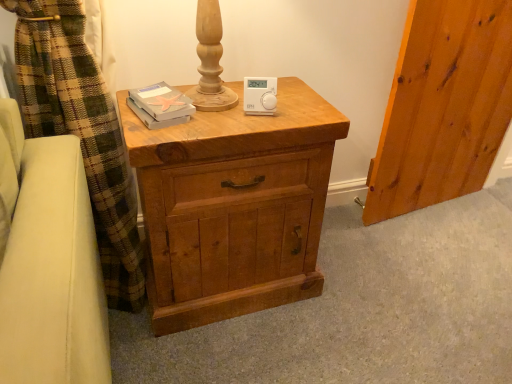
Where is `vacant space to the right of matte gray book at upper left`? The width and height of the screenshot is (512, 384). vacant space to the right of matte gray book at upper left is located at coordinates (217, 106).